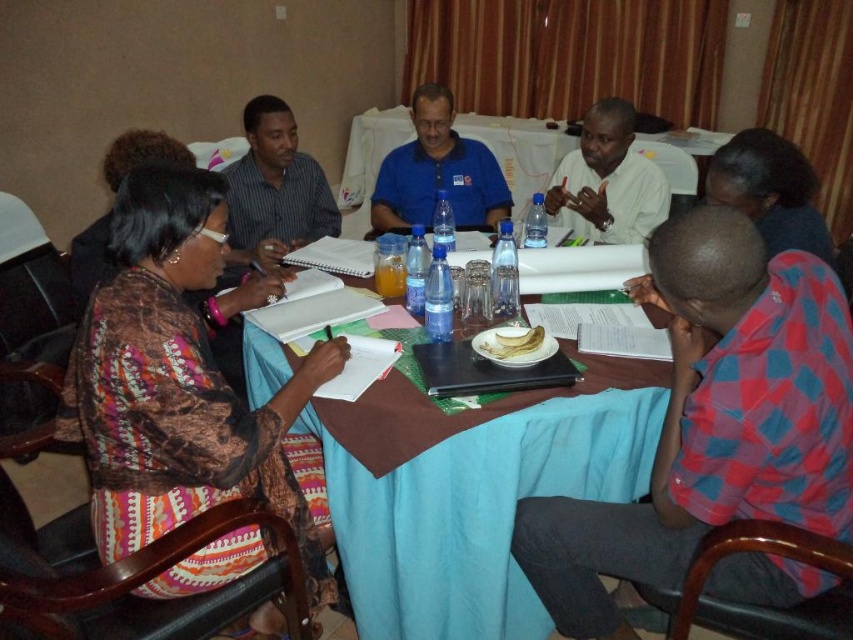
Question: Where is red checkered shirt at lower right located in relation to blue cotton shirt at center in the image?

Choices:
 (A) above
 (B) below

Answer: (B)

Question: Which point is closer to the camera taking this photo?

Choices:
 (A) (173, 161)
 (B) (427, 134)

Answer: (A)

Question: In this image, where is brown printed fabric at left located relative to blue fabric table at center?

Choices:
 (A) below
 (B) above

Answer: (B)

Question: Which point is farther from the camera taking this photo?

Choices:
 (A) (352, 573)
 (B) (229, 346)
 (C) (653, 188)
 (D) (692, 344)

Answer: (C)

Question: Is the position of brown printed fabric at left less distant than that of white shirt at upper center?

Choices:
 (A) yes
 (B) no

Answer: (A)

Question: Among these points, which one is farthest from the camera?

Choices:
 (A) (x=285, y=221)
 (B) (x=293, y=499)
 (C) (x=572, y=138)

Answer: (C)